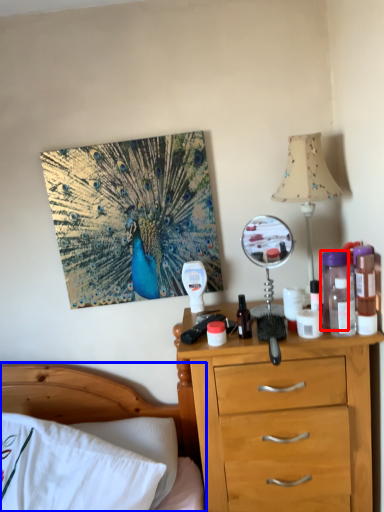
Question: Among these objects, which one is nearest to the camera, bottle (highlighted by a red box) or bed (highlighted by a blue box)?

Choices:
 (A) bottle
 (B) bed

Answer: (B)